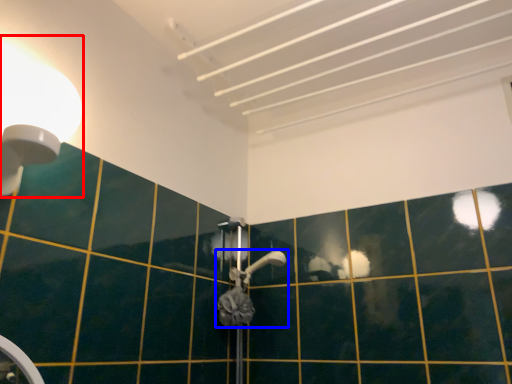
Question: Which object appears closest to the camera in this image, light fixture (highlighted by a red box) or shower (highlighted by a blue box)?

Choices:
 (A) light fixture
 (B) shower

Answer: (A)